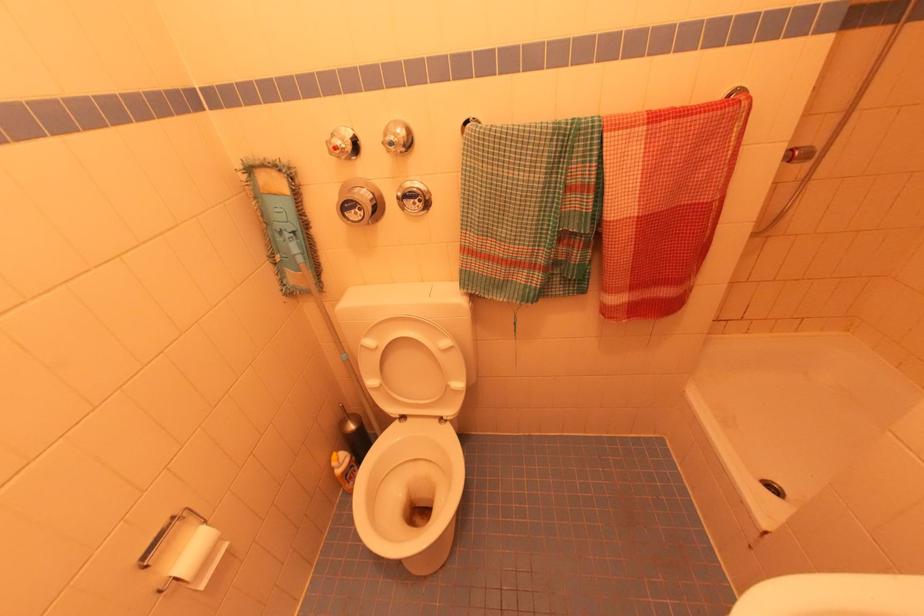
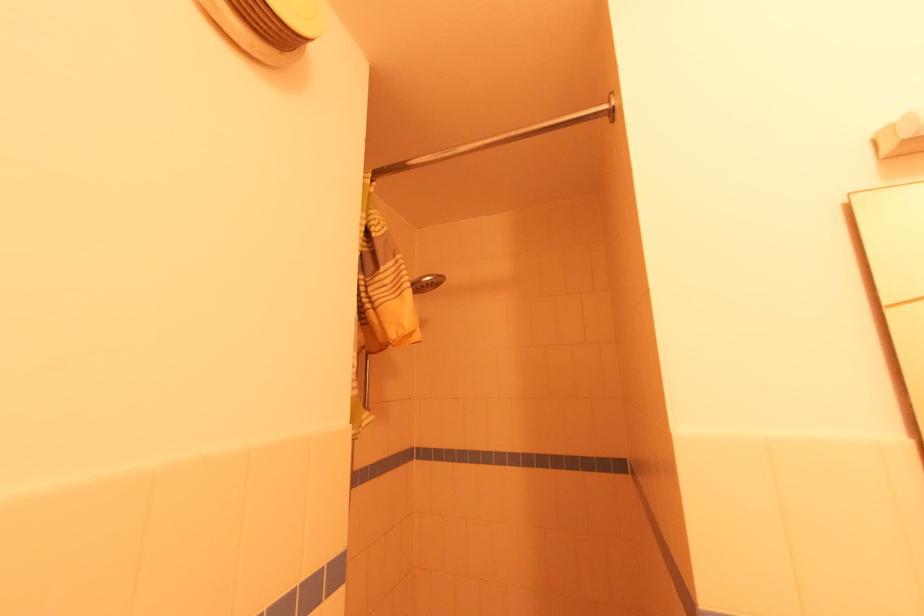
The images are taken continuously from a first-person perspective. In which direction is your viewpoint rotating?

The camera rotated toward right-up.